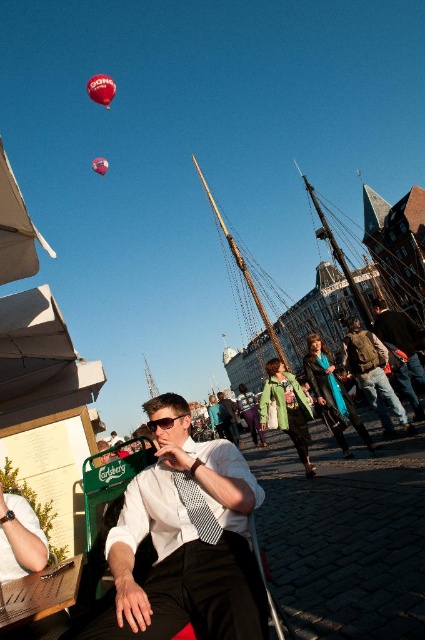
Who is positioned more to the right, leather jacket at center or matte white shirt at center?

From the viewer's perspective, leather jacket at center appears more on the right side.

Where is `leather jacket at center`? The width and height of the screenshot is (425, 640). leather jacket at center is located at coordinates (401, 349).

Does brown leather jacket at center have a lesser width compared to black plastic sunglasses at center?

Yes, brown leather jacket at center is thinner than black plastic sunglasses at center.

Who is more forward, [345,340] or [169,419]?

Point [169,419]

Identify the location of brown leather jacket at center. (373, 374).

Does point (390, 317) lie in front of point (113, 92)?

That is True.

Measure the distance between point (382, 324) and camera.

Point (382, 324) and camera are 38.29 meters apart.

This screenshot has height=640, width=425. What are the coordinates of `leather jacket at center` in the screenshot? It's located at (401, 349).